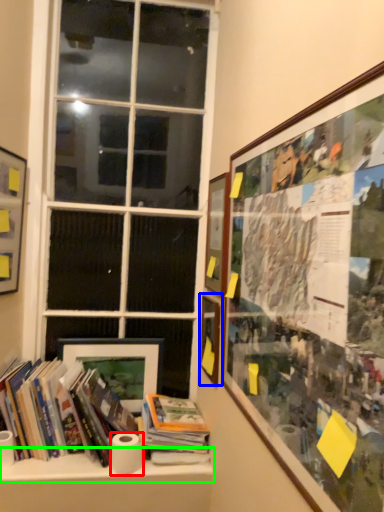
Question: Which is nearer to the toilet paper (highlighted by a red box)? picture frame (highlighted by a blue box) or window sill (highlighted by a green box).

Choices:
 (A) picture frame
 (B) window sill

Answer: (B)